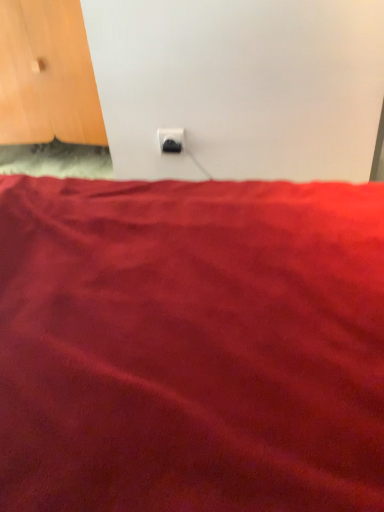
Question: Is the surface of black plastic power plug at center in direct contact with wooden door at upper left?

Choices:
 (A) no
 (B) yes

Answer: (A)

Question: Does black plastic power plug at center have a greater width compared to wooden door at upper left?

Choices:
 (A) yes
 (B) no

Answer: (B)

Question: Is wooden door at upper left completely or partially inside black plastic power plug at center?

Choices:
 (A) no
 (B) yes

Answer: (A)

Question: From the image's perspective, is black plastic power plug at center under wooden door at upper left?

Choices:
 (A) yes
 (B) no

Answer: (A)

Question: Does black plastic power plug at center have a greater height compared to wooden door at upper left?

Choices:
 (A) yes
 (B) no

Answer: (B)

Question: From a real-world perspective, is black plastic power plug at center located higher than wooden door at upper left?

Choices:
 (A) yes
 (B) no

Answer: (B)

Question: Is wooden door at upper left aimed at black plastic power plug at center?

Choices:
 (A) yes
 (B) no

Answer: (B)

Question: From the image's perspective, would you say wooden door at upper left is positioned over black plastic power plug at center?

Choices:
 (A) yes
 (B) no

Answer: (A)

Question: Does wooden door at upper left have a greater width compared to black plastic power plug at center?

Choices:
 (A) no
 (B) yes

Answer: (B)

Question: Is wooden door at upper left touching black plastic power plug at center?

Choices:
 (A) no
 (B) yes

Answer: (A)

Question: Is wooden door at upper left thinner than black plastic power plug at center?

Choices:
 (A) yes
 (B) no

Answer: (B)

Question: Can you confirm if wooden door at upper left is shorter than black plastic power plug at center?

Choices:
 (A) yes
 (B) no

Answer: (B)

Question: Considering the positions of point (178, 132) and point (87, 74), is point (178, 132) closer or farther from the camera than point (87, 74)?

Choices:
 (A) closer
 (B) farther

Answer: (A)